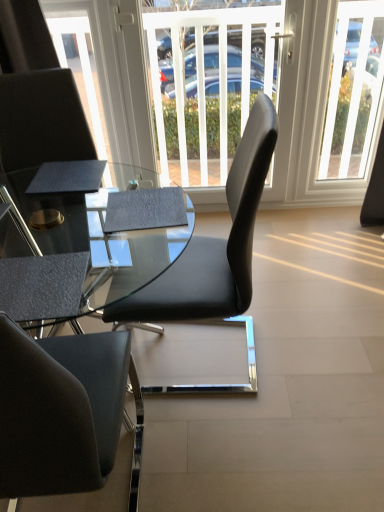
Question: In terms of size, does clear glass door at upper center appear bigger or smaller than black leather chair at left, placed as the 2th chair when sorted from right to left?

Choices:
 (A) big
 (B) small

Answer: (B)

Question: Is clear glass door at upper center in front of or behind black leather chair at left, placed as the 2th chair when sorted from right to left, in the image?

Choices:
 (A) front
 (B) behind

Answer: (B)

Question: Which object is positioned closest to the clear glass door at upper center?

Choices:
 (A) black leather chair at center, the 1th chair viewed from the right
 (B) matte black glass table at center
 (C) textured black armchair at lower left
 (D) white matte door at center
 (E) black leather chair at left, which ranks as the 1th chair in left-to-right order

Answer: (D)

Question: Based on their relative distances, which object is farther from the matte black glass table at center?

Choices:
 (A) textured black armchair at lower left
 (B) black leather chair at center, the 1th chair viewed from the right
 (C) white matte door at center
 (D) black leather chair at left, placed as the 2th chair when sorted from right to left
 (E) clear glass door at upper center

Answer: (E)